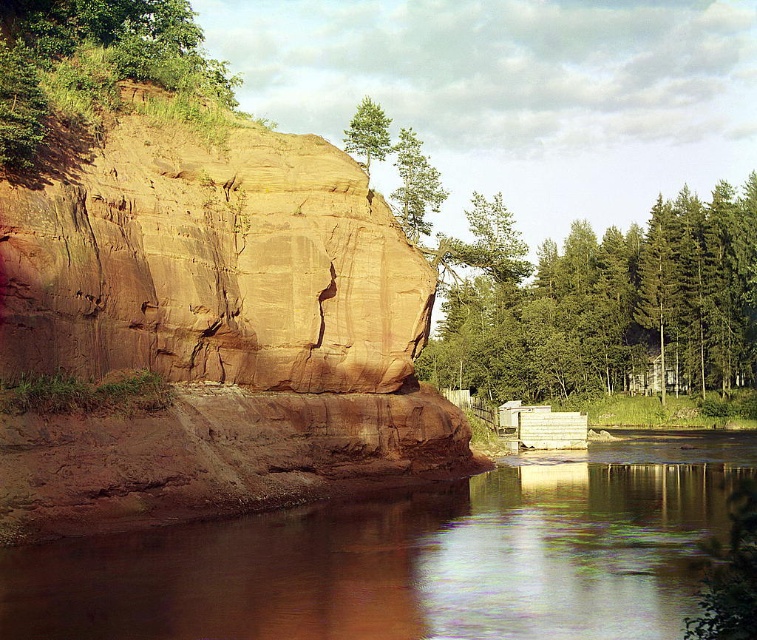
Question: In this image, where is brown smooth rock at lower center located relative to green leafy tree at upper center?

Choices:
 (A) left
 (B) right

Answer: (B)

Question: Based on their relative distances, which object is farther from the brown rough rock face at upper left?

Choices:
 (A) green matte tree at upper center
 (B) brown smooth rock at lower center

Answer: (A)

Question: Which of these objects is positioned farthest from the brown smooth rock at lower center?

Choices:
 (A) green leafy tree at upper left
 (B) green matte tree at upper center
 (C) green leafy trees at right
 (D) brown rough rock face at upper left

Answer: (C)

Question: Considering the real-world distances, which object is farthest from the green matte tree at upper center?

Choices:
 (A) brown rough rock face at upper left
 (B) green leafy tree at upper center
 (C) brown smooth rock at lower center

Answer: (C)

Question: Can you confirm if brown smooth rock at lower center is wider than green matte tree at upper center?

Choices:
 (A) no
 (B) yes

Answer: (B)

Question: Can you confirm if brown smooth rock at lower center is smaller than green leafy trees at right?

Choices:
 (A) yes
 (B) no

Answer: (A)